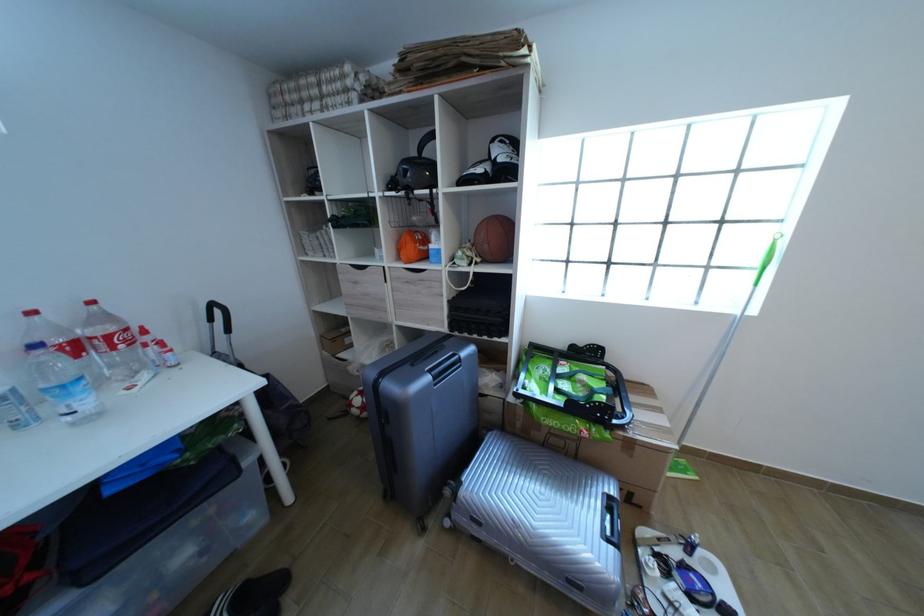
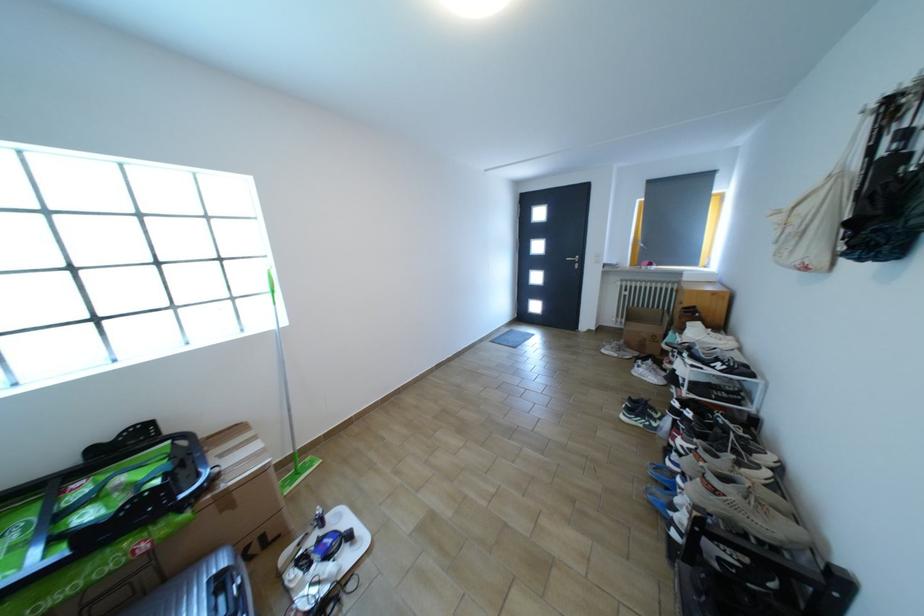
Question: How did the camera likely rotate?

Choices:
 (A) Left
 (B) Right
 (C) Up
 (D) Down

Answer: (B)